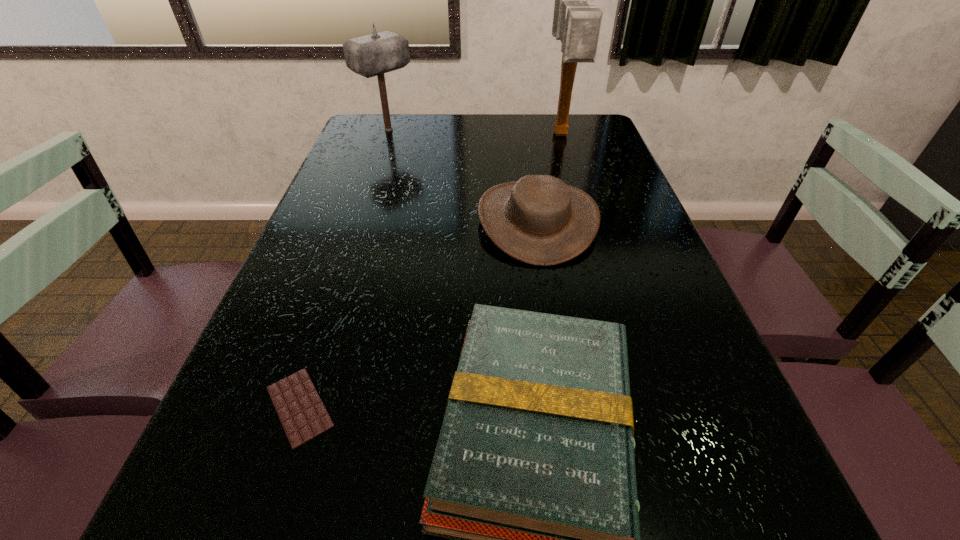
The width and height of the screenshot is (960, 540). What are the coordinates of `vacant region between the left mallet and the shortest object` in the screenshot? It's located at (344, 268).

This screenshot has width=960, height=540. I want to click on object identified as the third closest to the shorter mallet, so click(x=533, y=480).

You are a GUI agent. You are given a task and a screenshot of the screen. Output one action in this format:
    pyautogui.click(x=<x>, y=<y>)
    Task: Click on the object that is the third closest to the cowboy hat
    Image resolution: width=960 pixels, height=540 pixels.
    Given the screenshot: What is the action you would take?
    pyautogui.click(x=372, y=55)

The image size is (960, 540). I want to click on free space that satisfies the following two spatial constraints: 1. on the back side of the chocolate bar; 2. on the right side of the third farthest object, so click(x=362, y=220).